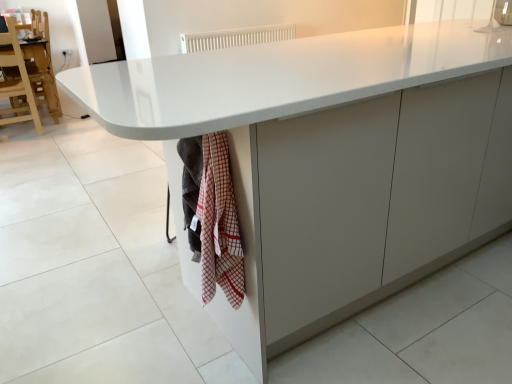
What are the coordinates of `empty space that is ontop of white glossy granite at lower left (from a real-world perspective)` in the screenshot? It's located at (132, 345).